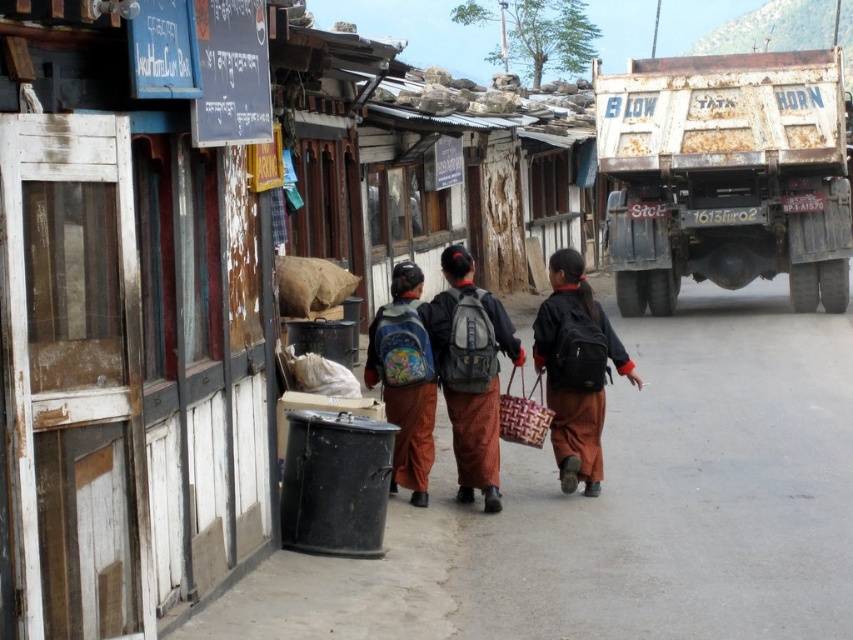
Question: Which of the following is the farthest from the observer?

Choices:
 (A) brown fabric at center
 (B) matte black backpacks at center

Answer: (B)

Question: Can you confirm if brown fabric at center is bigger than black fabric backpack at center?

Choices:
 (A) yes
 (B) no

Answer: (A)

Question: Which of the following is the farthest from the observer?

Choices:
 (A) matte black backpacks at center
 (B) black fabric backpack at center
 (C) brown fabric at center

Answer: (B)

Question: Which of the following is the farthest from the observer?

Choices:
 (A) rusty metal truck at right
 (B) matte black backpacks at center

Answer: (A)

Question: Does matte black backpacks at center lie in front of black fabric backpack at center?

Choices:
 (A) no
 (B) yes

Answer: (B)

Question: Can you confirm if brown fabric at center is positioned to the right of matte colorful backpack at center?

Choices:
 (A) yes
 (B) no

Answer: (A)